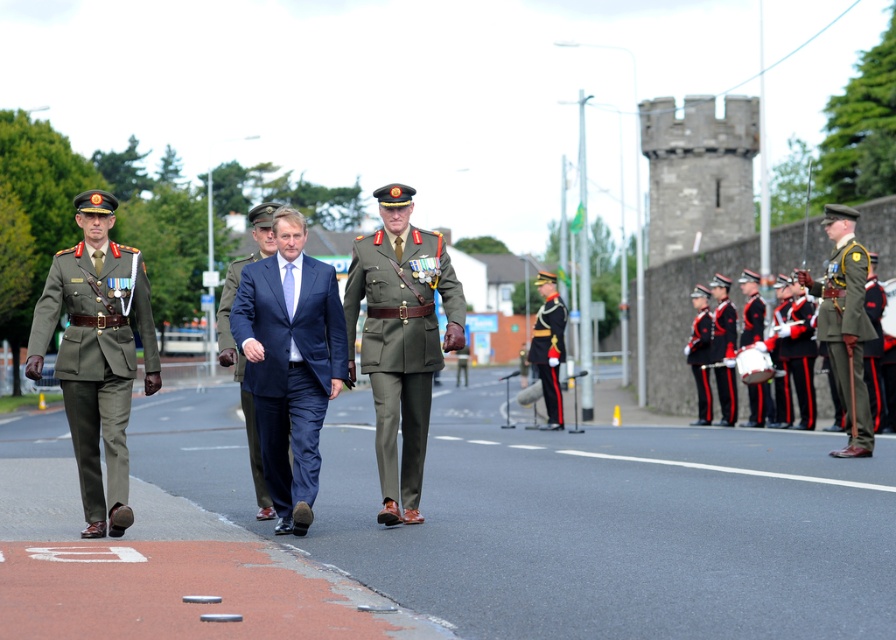
Is matte olive-green uniform at left to the right of green matte uniform at right from the viewer's perspective?

In fact, matte olive-green uniform at left is to the left of green matte uniform at right.

Consider the image. Does matte olive-green uniform at left lie behind green matte uniform at right?

That is False.

Is point (69, 342) farther from viewer compared to point (860, 346)?

That is False.

The height and width of the screenshot is (640, 896). Identify the location of matte olive-green uniform at left. (97, 353).

Measure the distance from navy blue suit at center to dark blue suit at center.

navy blue suit at center is 28.11 inches from dark blue suit at center.

Does navy blue suit at center have a lesser width compared to dark blue suit at center?

Indeed, navy blue suit at center has a lesser width compared to dark blue suit at center.

Between point (293, 371) and point (247, 436), which one is positioned behind?

Point (247, 436)

This screenshot has height=640, width=896. I want to click on navy blue suit at center, so click(290, 364).

Can you confirm if matte olive-green uniform at left is smaller than shiny gold helmet at center?

No, matte olive-green uniform at left is not smaller than shiny gold helmet at center.

Where is `matte olive-green uniform at left`? Image resolution: width=896 pixels, height=640 pixels. matte olive-green uniform at left is located at coordinates (97, 353).

Does point (105, 419) lie in front of point (548, 284)?

Yes, point (105, 419) is in front of point (548, 284).

Locate an element on the screen. The width and height of the screenshot is (896, 640). matte olive-green uniform at left is located at coordinates (97, 353).